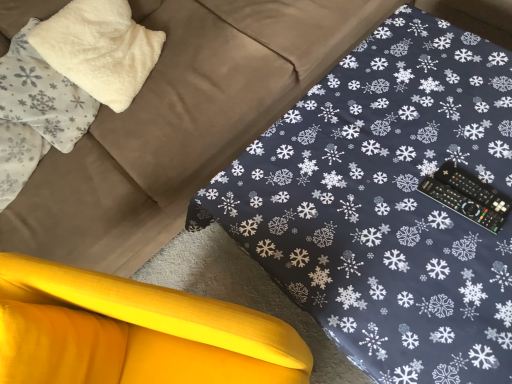
Question: Does yellow fabric cushion at lower left have a lesser height compared to white fluffy pillow at upper left, the first pillow when ordered from right to left?

Choices:
 (A) yes
 (B) no

Answer: (B)

Question: Does yellow fabric cushion at lower left lie behind white fluffy pillow at upper left, which ranks as the 2th pillow in left-to-right order?

Choices:
 (A) yes
 (B) no

Answer: (B)

Question: Is the depth of yellow fabric cushion at lower left less than that of white fluffy pillow at upper left, the first pillow when ordered from right to left?

Choices:
 (A) no
 (B) yes

Answer: (B)

Question: Can you confirm if yellow fabric cushion at lower left is positioned to the right of white fluffy pillow at upper left, the first pillow when ordered from right to left?

Choices:
 (A) yes
 (B) no

Answer: (A)

Question: Does yellow fabric cushion at lower left have a smaller size compared to white fluffy pillow at upper left, the first pillow when ordered from right to left?

Choices:
 (A) no
 (B) yes

Answer: (A)

Question: Is yellow fabric cushion at lower left far away from white fluffy pillow at upper left, which ranks as the 2th pillow in left-to-right order?

Choices:
 (A) no
 (B) yes

Answer: (A)

Question: Is the position of black plastic remote at right less distant than that of yellow fabric cushion at lower left?

Choices:
 (A) yes
 (B) no

Answer: (B)

Question: Is yellow fabric cushion at lower left located within black plastic remote at right?

Choices:
 (A) no
 (B) yes

Answer: (A)

Question: Could you tell me if black plastic remote at right is turned towards yellow fabric cushion at lower left?

Choices:
 (A) yes
 (B) no

Answer: (B)

Question: Is black plastic remote at right next to yellow fabric cushion at lower left?

Choices:
 (A) yes
 (B) no

Answer: (B)

Question: From the image's perspective, is black plastic remote at right on top of yellow fabric cushion at lower left?

Choices:
 (A) no
 (B) yes

Answer: (B)

Question: Can we say black plastic remote at right lies outside yellow fabric cushion at lower left?

Choices:
 (A) no
 (B) yes

Answer: (B)

Question: Is yellow fabric cushion at lower left thinner than white fluffy pillow at upper left, which is counted as the 1th pillow, starting from the left?

Choices:
 (A) yes
 (B) no

Answer: (B)